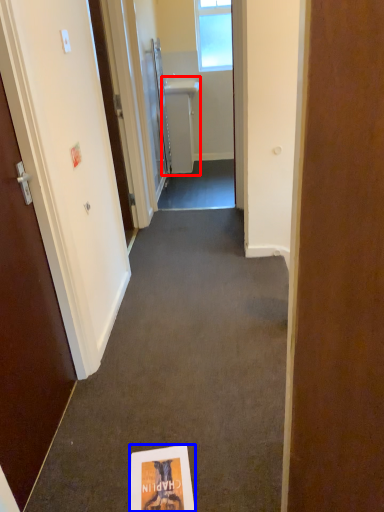
Question: Which object appears farthest to the camera in this image, sink (highlighted by a red box) or flyer (highlighted by a blue box)?

Choices:
 (A) sink
 (B) flyer

Answer: (A)